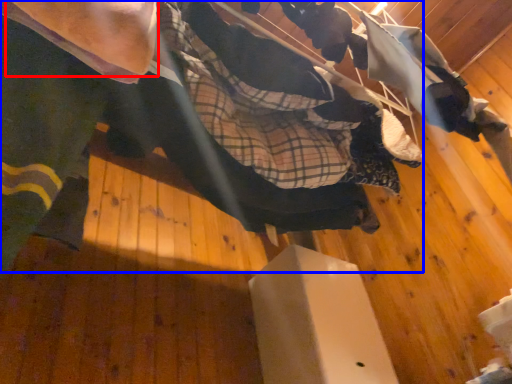
Question: Which of the following is the closest to the observer, arm (highlighted by a red box) or skateboarder (highlighted by a blue box)?

Choices:
 (A) arm
 (B) skateboarder

Answer: (A)